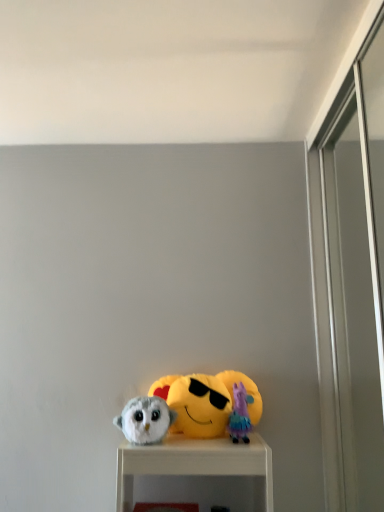
Question: Does fluffy white owl at lower left, which is the first toy from left to right, have a larger size compared to yellow plush at center?

Choices:
 (A) no
 (B) yes

Answer: (A)

Question: Can yellow plush at center be found inside fluffy white owl at lower left, which is the first toy from left to right?

Choices:
 (A) no
 (B) yes

Answer: (A)

Question: Is fluffy white owl at lower left, the second toy when ordered from right to left, wider than yellow plush at center?

Choices:
 (A) yes
 (B) no

Answer: (A)

Question: Does fluffy white owl at lower left, which is the first toy from left to right, appear on the left side of yellow plush at center?

Choices:
 (A) yes
 (B) no

Answer: (A)

Question: Does fluffy white owl at lower left, the second toy when ordered from right to left, have a lesser height compared to yellow plush at center?

Choices:
 (A) yes
 (B) no

Answer: (A)

Question: Does fluffy white owl at lower left, the second toy when ordered from right to left, have a greater height compared to yellow plush at center?

Choices:
 (A) yes
 (B) no

Answer: (B)

Question: From a real-world perspective, is yellow plush at center on fluffy white owl at lower left, which is the first toy from left to right?

Choices:
 (A) yes
 (B) no

Answer: (A)

Question: From the image's perspective, is yellow plush at center beneath fluffy white owl at lower left, the second toy when ordered from right to left?

Choices:
 (A) no
 (B) yes

Answer: (A)

Question: Can you confirm if yellow plush at center is smaller than fluffy white owl at lower left, which is the first toy from left to right?

Choices:
 (A) yes
 (B) no

Answer: (B)

Question: Could you tell me if yellow plush at center is facing fluffy white owl at lower left, which is the first toy from left to right?

Choices:
 (A) no
 (B) yes

Answer: (A)

Question: Is yellow plush at center shorter than fluffy white owl at lower left, the second toy when ordered from right to left?

Choices:
 (A) no
 (B) yes

Answer: (A)

Question: From a real-world perspective, is yellow plush at center beneath fluffy white owl at lower left, the second toy when ordered from right to left?

Choices:
 (A) yes
 (B) no

Answer: (B)

Question: Are plush purple at center, marked as the second toy in a left-to-right arrangement, and fluffy white owl at lower left, the second toy when ordered from right to left, beside each other?

Choices:
 (A) yes
 (B) no

Answer: (B)